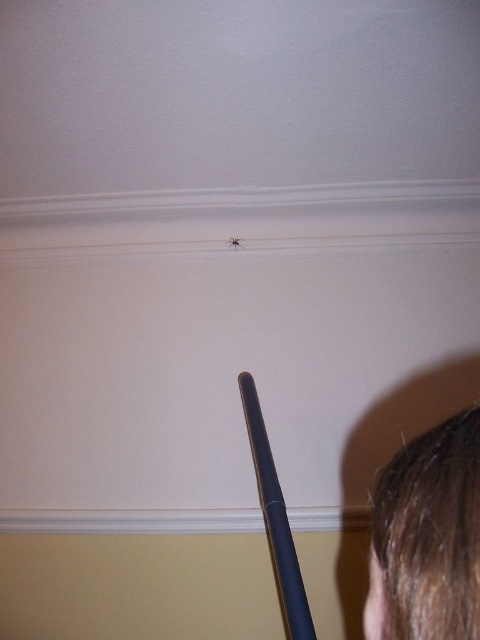
You are standing in a room and looking up at the ceiling. You see a small spider on the ceiling near the center and a dark object extending diagonally from the lower left to upper middle. There is also a point marked at coordinates (428, 538). What object is located at that point?

The dark brown hair at lower right is located at point (428, 538).